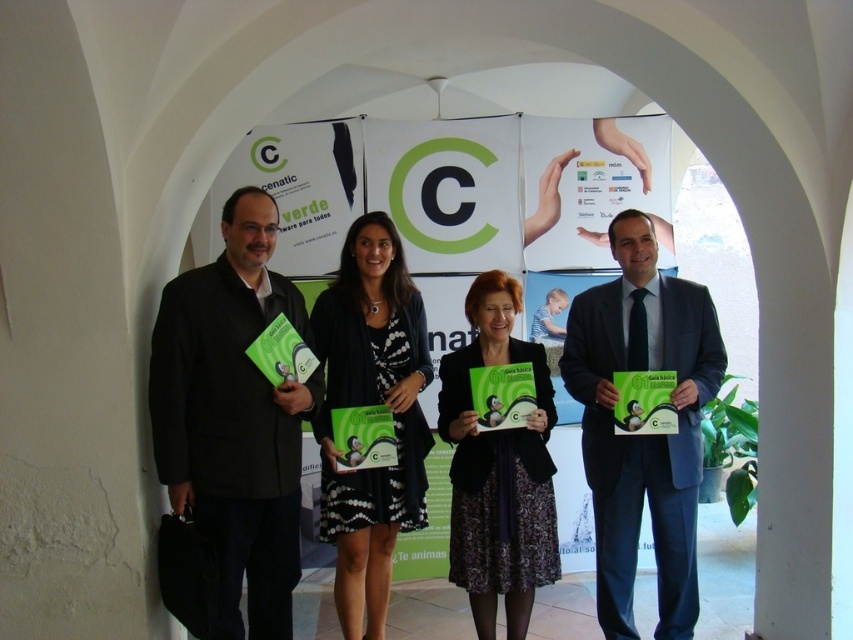
Does matte black suit at left have a lesser width compared to matte black jacket at center?

Incorrect, matte black suit at left's width is not less than matte black jacket at center's.

Who is more forward, (276,456) or (485,433)?

Point (276,456) is more forward.

Find the location of a particular element. This screenshot has width=853, height=640. matte black suit at left is located at coordinates (223, 378).

Is matte black suit at center smaller than black dotted dress at center?

Incorrect, matte black suit at center is not smaller in size than black dotted dress at center.

Is point (685, 480) closer to viewer compared to point (398, 461)?

That is True.

This screenshot has height=640, width=853. I want to click on matte black suit at center, so click(642, 435).

At what (x,y) coordinates should I click in order to perform the action: click on matte black suit at center. Please return your answer as a coordinate pair (x, y). Looking at the image, I should click on (642, 435).

Does matte black suit at center come in front of matte black jacket at center?

Yes, it is.

Does point (688, 352) lie behind point (524, 612)?

Yes, it is.

Locate an element on the screen. Image resolution: width=853 pixels, height=640 pixels. matte black suit at center is located at coordinates (642, 435).